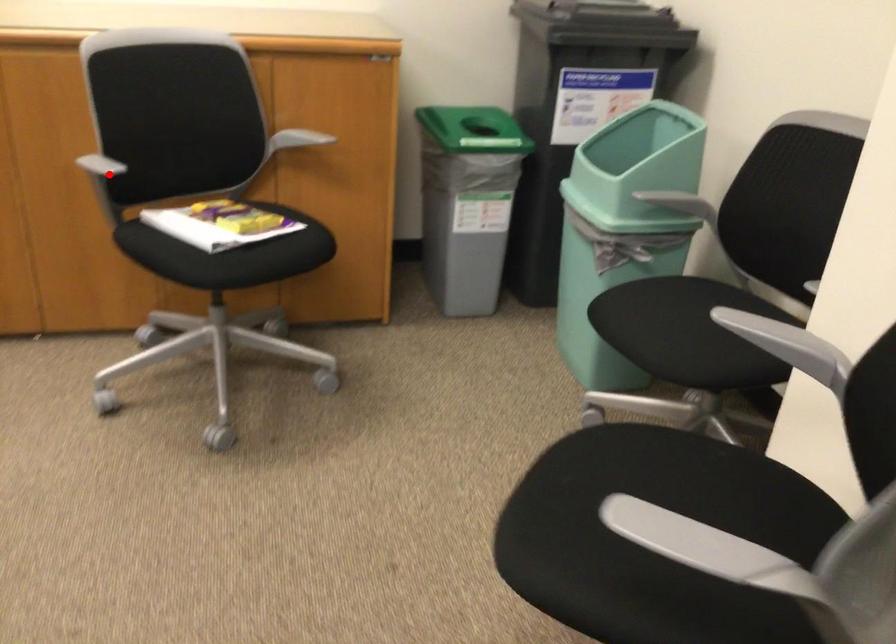
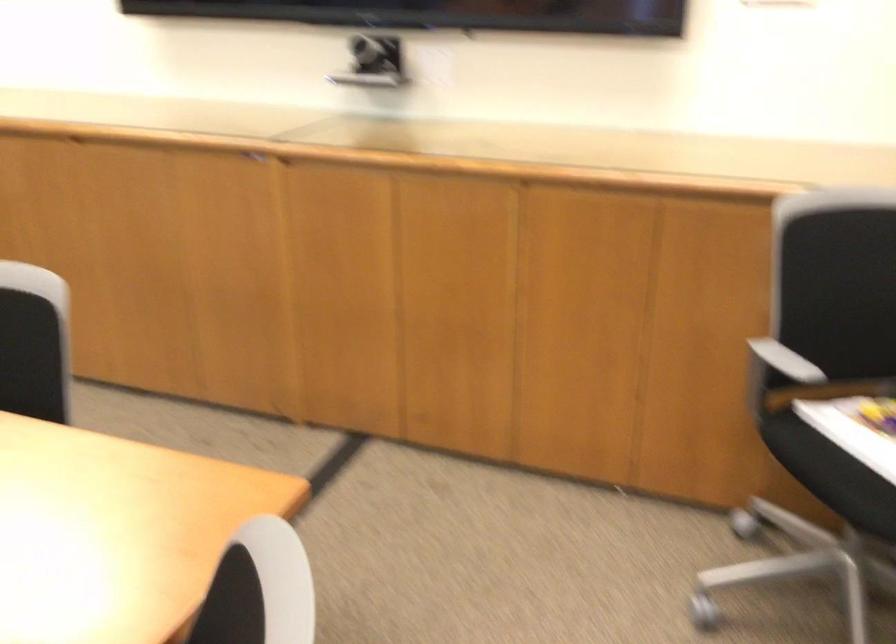
Question: I am providing you with two images of the same scene from different viewpoints. In image1, a red point is highlighted. Considering the same 3D point in image2, which of the following is correct?

Choices:
 (A) It is closer
 (B) It is farther

Answer: (A)